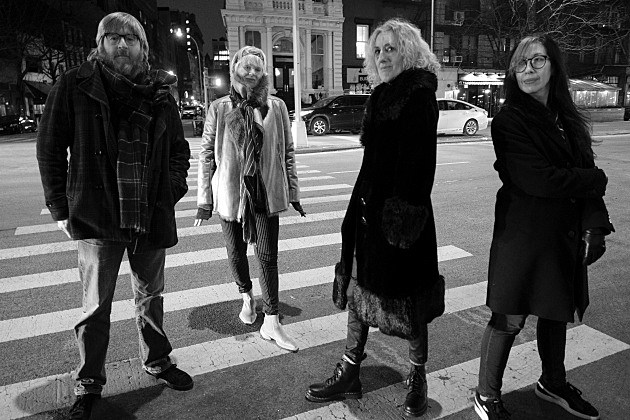
I want to click on window air conditioner, so click(454, 60).